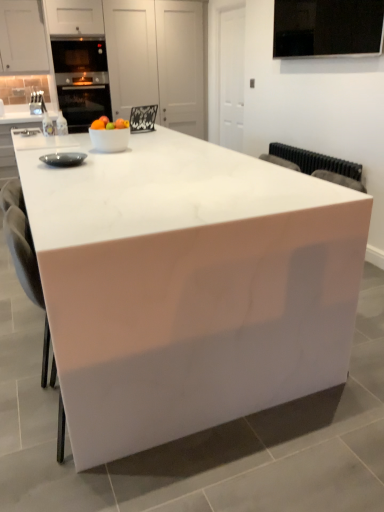
Question: Should I look upward or downward to see matte black bowl at left?

Choices:
 (A) down
 (B) up

Answer: (B)

Question: Could white glossy bowl at center be considered to be inside matte black bowl at left?

Choices:
 (A) yes
 (B) no

Answer: (B)

Question: From a real-world perspective, is matte black bowl at left physically below white glossy bowl at center?

Choices:
 (A) no
 (B) yes

Answer: (B)

Question: From a real-world perspective, is matte black bowl at left on top of white glossy bowl at center?

Choices:
 (A) no
 (B) yes

Answer: (A)

Question: Is matte black bowl at left smaller than white glossy bowl at center?

Choices:
 (A) yes
 (B) no

Answer: (A)

Question: Is matte black bowl at left far from white glossy bowl at center?

Choices:
 (A) yes
 (B) no

Answer: (B)

Question: Is matte black bowl at left shorter than white glossy bowl at center?

Choices:
 (A) yes
 (B) no

Answer: (A)

Question: Is white glossy bowl at center positioned in front of matte black bowl at left?

Choices:
 (A) no
 (B) yes

Answer: (A)

Question: Can you confirm if white glossy bowl at center is smaller than matte black bowl at left?

Choices:
 (A) no
 (B) yes

Answer: (A)

Question: Is white glossy bowl at center looking in the opposite direction of matte black bowl at left?

Choices:
 (A) yes
 (B) no

Answer: (B)

Question: Can you confirm if white glossy bowl at center is taller than matte black bowl at left?

Choices:
 (A) no
 (B) yes

Answer: (B)

Question: Can you confirm if white glossy bowl at center is bigger than matte black bowl at left?

Choices:
 (A) no
 (B) yes

Answer: (B)

Question: Is white glossy bowl at center wider than matte black bowl at left?

Choices:
 (A) yes
 (B) no

Answer: (A)

Question: Is white glossy table at center far away from white glossy bowl at center?

Choices:
 (A) no
 (B) yes

Answer: (A)